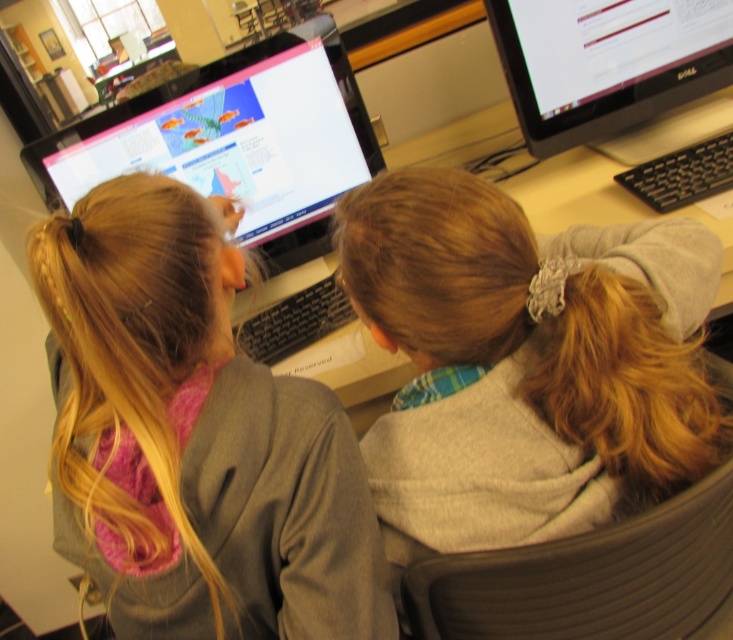
Looking at this image, you are taking a photo of two points in the scene. Which point, point (152,355) or point (550,19), will appear larger in your photo?

Point (152,355) will appear larger in the photo because it is closer to the camera than point (550,19).

You are a technician trying to locate the black glossy monitor at upper right on a desk with multiple monitors. Based on the coordinates provided in the scene description, can you determine its position relative to the other monitors?

The black glossy monitor at upper right is located at point coordinates of (605, 61), which places it in the upper right position relative to the other monitors on the desk.